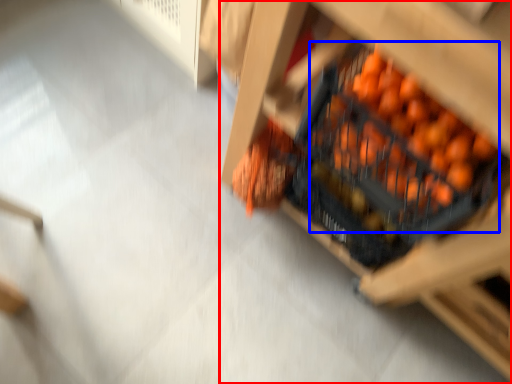
Question: Which of the following is the farthest to the observer, furniture (highlighted by a red box) or fruit (highlighted by a blue box)?

Choices:
 (A) furniture
 (B) fruit

Answer: (B)